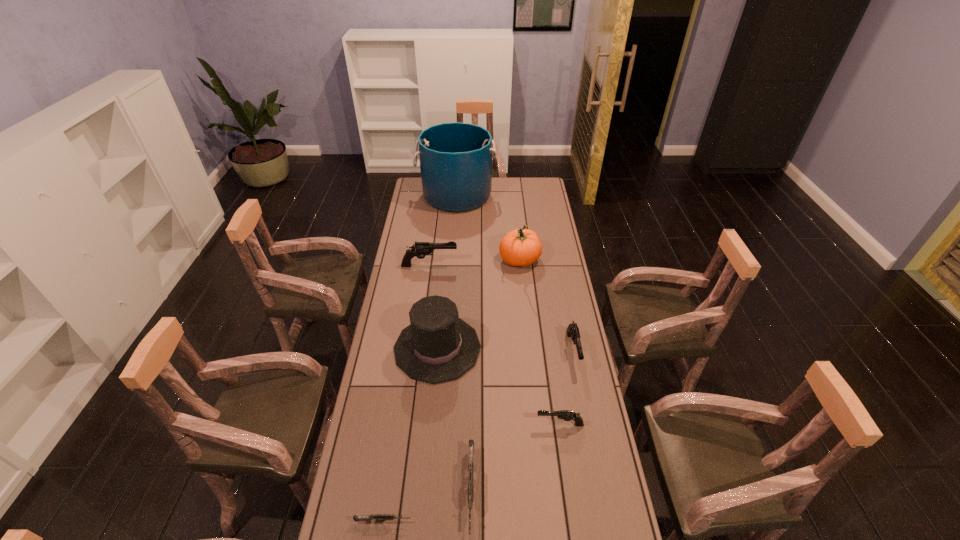
You are a GUI agent. You are given a task and a screenshot of the screen. Output one action in this format:
    pyautogui.click(x=<x>, y=<y>)
    Task: Click on the third nearest gun
    Image resolution: width=960 pixels, height=540 pixels.
    Given the screenshot: What is the action you would take?
    pyautogui.click(x=567, y=415)

Find the location of `the smallest black gun`. the smallest black gun is located at coordinates (567, 415).

This screenshot has width=960, height=540. I want to click on the smaller grey gun, so click(377, 517).

Image resolution: width=960 pixels, height=540 pixels. I want to click on the left grey gun, so click(377, 517).

At what (x,y) coordinates should I click in order to perform the action: click on vacant space located on the right of the bucket. Please return your answer as a coordinate pair (x, y). This screenshot has width=960, height=540. Looking at the image, I should click on click(537, 196).

Where is `free space located on the front of the orange pumpkin`? free space located on the front of the orange pumpkin is located at coordinates (526, 324).

Where is `vacant region located on the front of the third tallest object with the decoration`? This screenshot has height=540, width=960. vacant region located on the front of the third tallest object with the decoration is located at coordinates (549, 348).

Where is `free space located at the end of the barrel of the biggest black gun`? This screenshot has width=960, height=540. free space located at the end of the barrel of the biggest black gun is located at coordinates (487, 266).

This screenshot has height=540, width=960. Identify the location of vacant space located at the end of the barrel of the fifth tallest object. (588, 430).

This screenshot has height=540, width=960. I want to click on blank area located at the end of the barrel of the third farthest gun, so click(x=492, y=424).